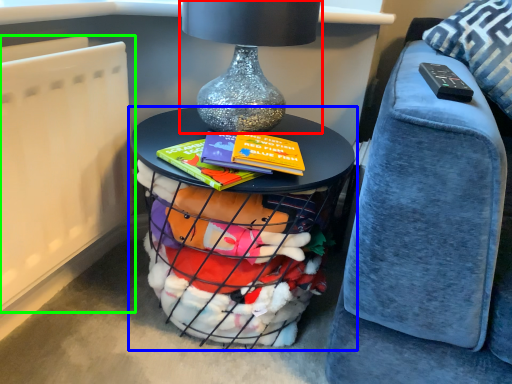
Question: Considering the real-world distances, which object is closest to table lamp (highlighted by a red box)? table (highlighted by a blue box) or radiator (highlighted by a green box).

Choices:
 (A) table
 (B) radiator

Answer: (A)